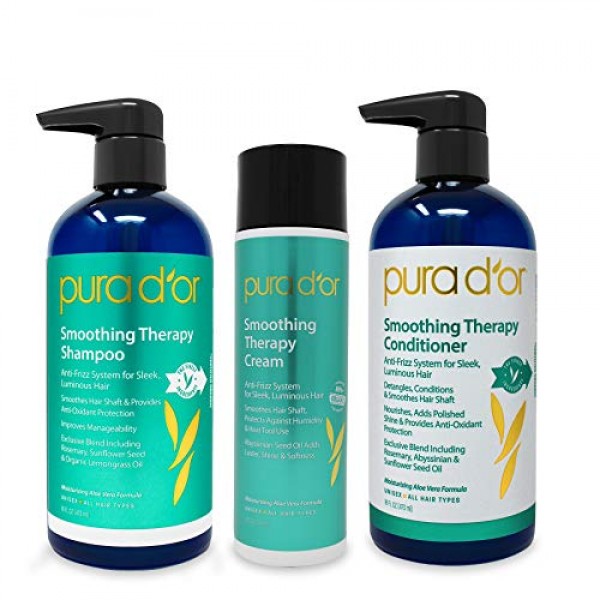
Identify the location of bottles. The height and width of the screenshot is (600, 600). (165, 337).